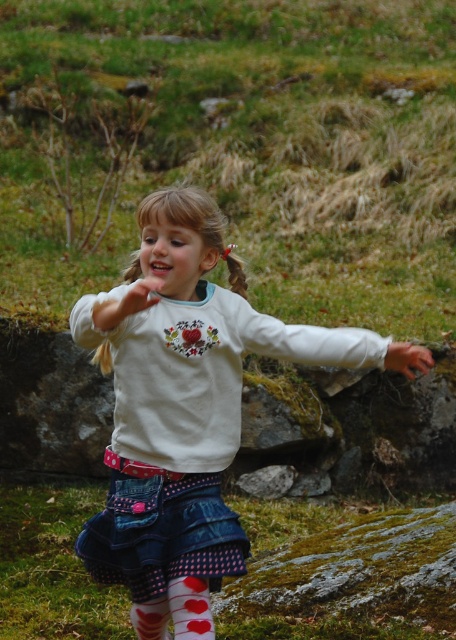
You are standing at the point marked by the coordinates point (182, 396) in the image. What object are you directly at?

The point (182, 396) marks the white cotton shirt at center.

You are a photographer trying to capture a closeup shot of the white cotton sock at lower left and the smooth skin hand at lower right. Which object should you focus on first to ensure it appears sharp in the photo?

The white cotton sock at lower left is further to the viewer than the smooth skin hand at lower right, so you should focus on the white cotton sock at lower left first to ensure it appears sharp in the photo.

You are a photographer trying to capture a closeup of the girl while ensuring both the white matte socks at lower center and the white cotton sock at lower left are visible in the frame. Given that your camera has a minimum focus distance of 20 centimeters, will you be able to focus on the girl without moving closer?

The white matte socks at lower center and the white cotton sock at lower left are 19.83 centimeters apart. Since the distance between them is less than the camera minimum focus distance of 20 centimeters, you can focus on the girl without moving closer.